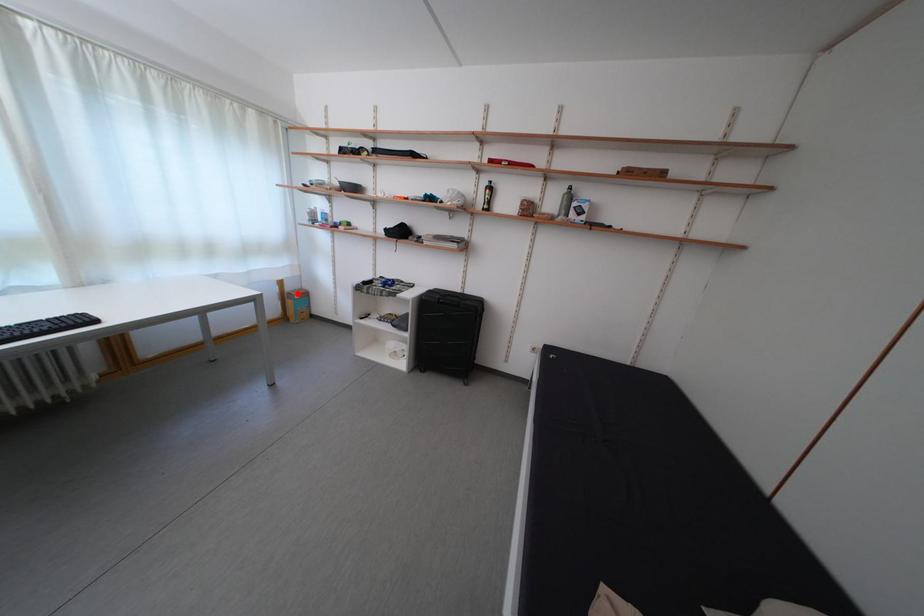
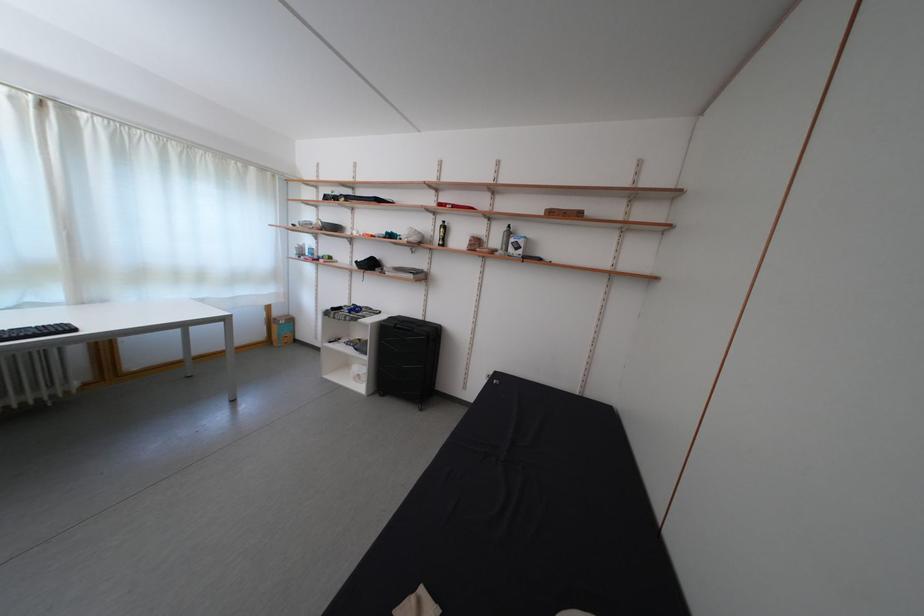
Find the pixel in the second image that matches the highlighted location in the first image.

(285, 320)